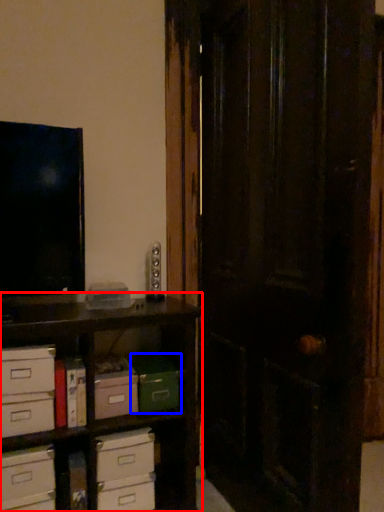
Question: Among these objects, which one is nearest to the camera, shelf (highlighted by a red box) or storage box (highlighted by a blue box)?

Choices:
 (A) shelf
 (B) storage box

Answer: (A)